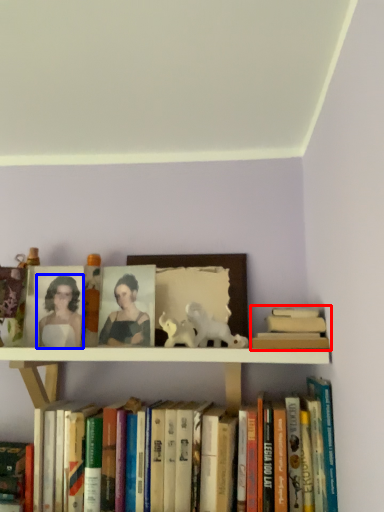
Question: Which point is closer to the camera, book (highlighted by a red box) or woman (highlighted by a blue box)?

Choices:
 (A) book
 (B) woman

Answer: (A)